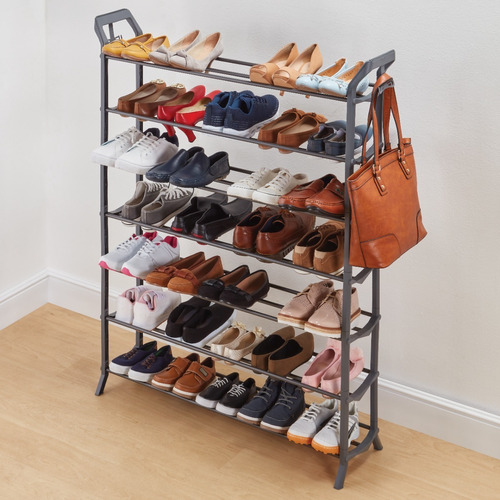
Image resolution: width=500 pixels, height=500 pixels. What are the coordinates of `shoes on bottom shelf` in the screenshot? It's located at (139, 369), (124, 361), (162, 375), (182, 386), (207, 389), (226, 399), (253, 408), (274, 414), (296, 427), (327, 439).